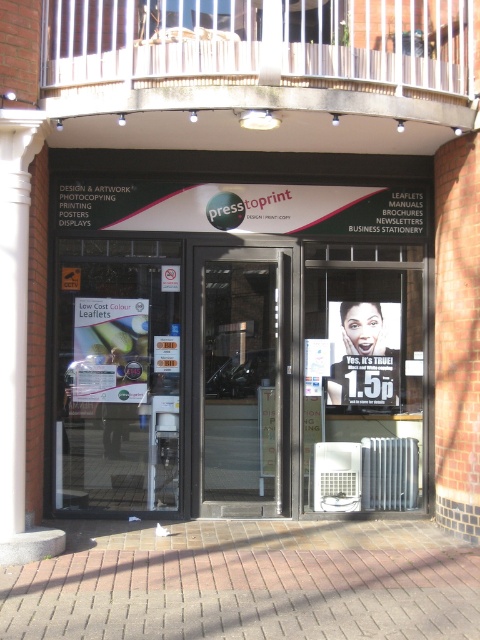
You are a delivery person approaching the entrance of the store. You need to place a heavy box on the ground near the entrance. Which object should you place it closer to, the brick pavement at lower center or the metallic air conditioner at center?

The brick pavement at lower center is closer to the viewer than the metallic air conditioner at center, so you should place the box closer to the brick pavement at lower center.

From the picture: You are standing in front of the press top print store and want to walk from point [280,208] to point [120,273]. Which direction should you move in relation to the store entrance?

Since point [280,208] is behind point [120,273], you should move forward towards the store entrance to reach point [120,273].